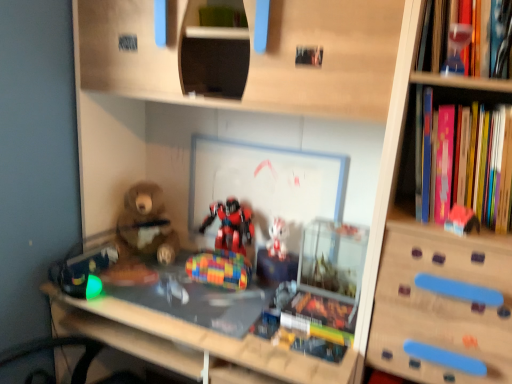
Question: Is transparent glass hourglass at upper right, which appears as the 2th toy when viewed from the right, taller or shorter than hardcover book at center, placed as the first book when sorted from bottom to top?

Choices:
 (A) short
 (B) tall

Answer: (B)

Question: Based on their positions, is transparent glass hourglass at upper right, which appears as the 2th toy when viewed from the right, located to the left or right of hardcover book at center, arranged as the 2th book when viewed from the top?

Choices:
 (A) left
 (B) right

Answer: (B)

Question: Which is nearer to the hardcover book at center, marked as the second book in a right-to-left arrangement?

Choices:
 (A) brown plush bear at left, the 6th toy when ordered from right to left
 (B) transparent glass hourglass at upper right, which appears as the 2th toy when viewed from the right
 (C) pink plastic toy at right, the 5th toy from the back
 (D) pink cardboard house at right, which is the 1th book in top-to-bottom order
 (E) white plush toy at center, the 4th toy positioned from the left

Answer: (E)

Question: Which object is the closest to the transparent glass hourglass at upper right, the 1th toy when ordered from front to back?

Choices:
 (A) wooden bookshelf at right
 (B) hardcover book at center, which is the 1th book in left-to-right order
 (C) white plush toy at center, which is the third toy in right-to-left order
 (D) multicolored plastic cube at center, acting as the 3th toy starting from the front
 (E) brown plush bear at left, the 4th toy positioned from the front

Answer: (A)